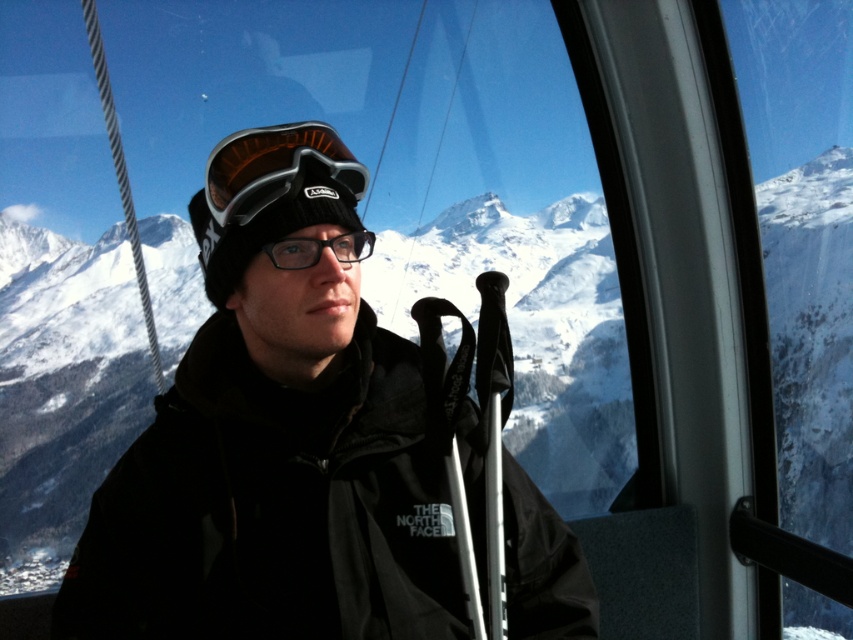
You are a photographer trying to capture the person in the ski lift cabin. You notice the black matte jacket at center and the matte black goggles at center. Which object is positioned closer to you?

The black matte jacket at center is closer to the viewer than the matte black goggles at center.

You are a photographer trying to capture the person in the ski lift cabin. You want to ensure that both the black matte jacket at center and the matte black goggles at center are clearly visible in your photo. Given their sizes, which object should you focus on first to ensure both are in frame?

The black matte jacket at center is taller than the matte black goggles at center, so focusing on the black matte jacket at center first will help ensure both objects are in frame since it occupies more vertical space.

You are a photographer taking a picture of the person in the ski lift cabin. You want to ensure both the black matte jacket at center and the matte black goggles at center are clearly visible. Which object should you focus on first if you want to capture both in sharp focus, considering their positions?

The black matte jacket at center is to the right of matte black goggles at center. To capture both in sharp focus, you should focus on the matte black goggles at center first since it is closer to the camera, then adjust to include the jacket.